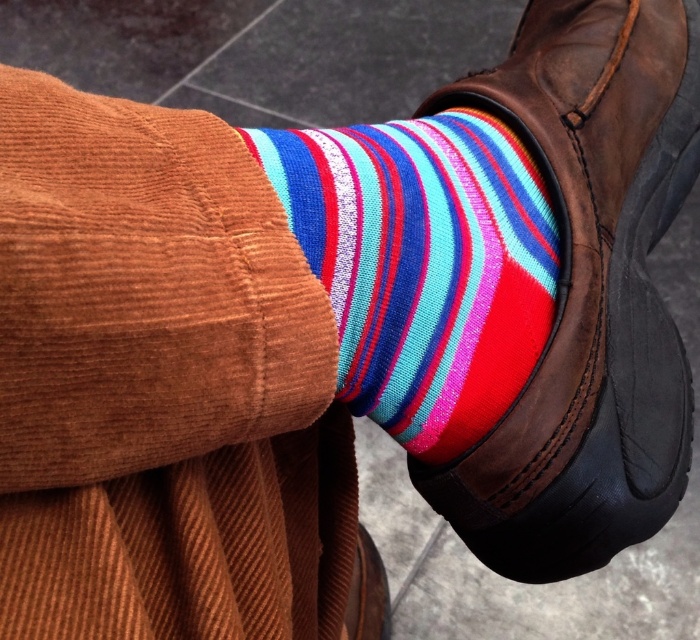
Question: Does multicolored striped sock at center appear over multicolored knitted sock at center?

Choices:
 (A) no
 (B) yes

Answer: (A)

Question: Does leather boot at center appear on the right side of multicolored knitted sock at center?

Choices:
 (A) yes
 (B) no

Answer: (A)

Question: Is multicolored striped sock at center closer to camera compared to multicolored knitted sock at center?

Choices:
 (A) no
 (B) yes

Answer: (B)

Question: Among these objects, which one is nearest to the camera?

Choices:
 (A) multicolored knitted sock at center
 (B) leather boot at center

Answer: (A)

Question: Which point is closer to the camera?

Choices:
 (A) multicolored striped sock at center
 (B) leather boot at center
 (C) multicolored knitted sock at center

Answer: (A)

Question: Which of the following is the farthest from the observer?

Choices:
 (A) leather boot at center
 (B) multicolored striped sock at center
 (C) multicolored knitted sock at center

Answer: (A)